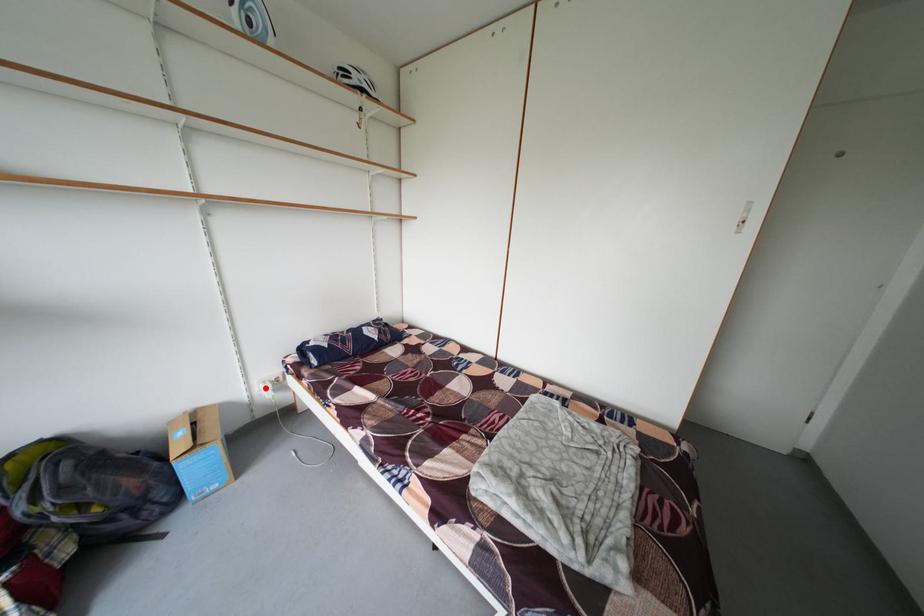
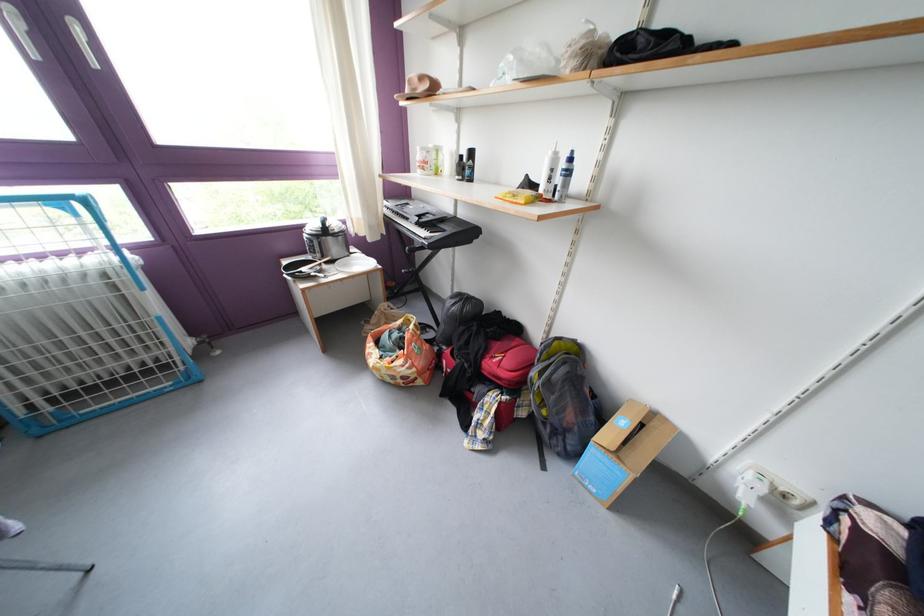
Question: I am providing you with two images of the same scene from different viewpoints. In image1, a red point is highlighted. Considering the same 3D point in image2, which of the following is correct?

Choices:
 (A) It is closer
 (B) It is farther

Answer: (A)